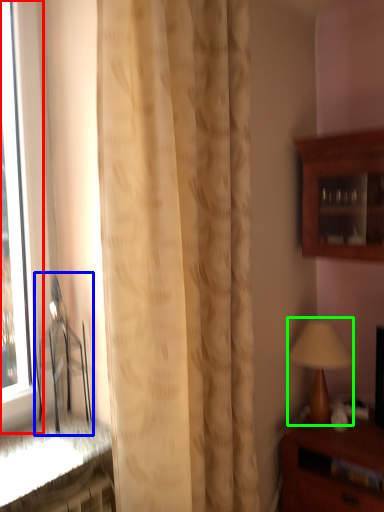
Question: Which object is the closest to the window (highlighted by a red box)? Choose among these: chair (highlighted by a blue box) or table lamp (highlighted by a green box).

Choices:
 (A) chair
 (B) table lamp

Answer: (A)